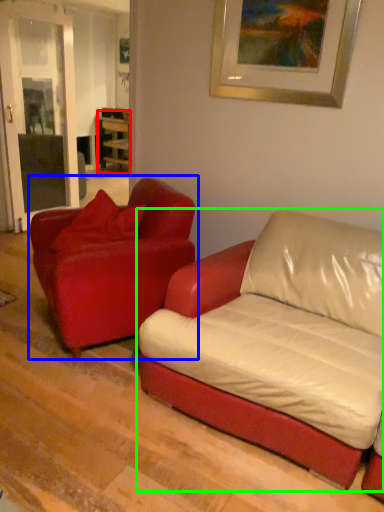
Question: Based on their relative distances, which object is nearer to table (highlighted by a red box)? Choose from studio couch (highlighted by a blue box) and studio couch (highlighted by a green box).

Choices:
 (A) studio couch
 (B) studio couch

Answer: (A)